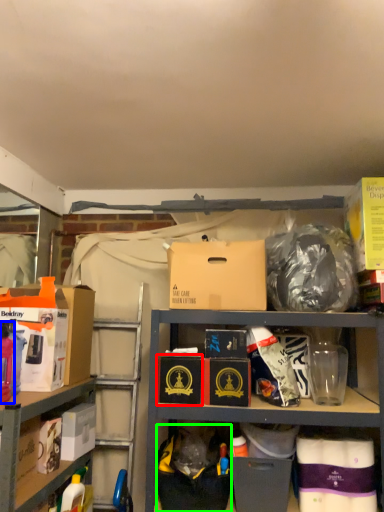
Question: Based on their relative distances, which object is farther from box (highlighted by a red box)? Choose from bottle (highlighted by a blue box) and garbage (highlighted by a green box).

Choices:
 (A) bottle
 (B) garbage

Answer: (A)